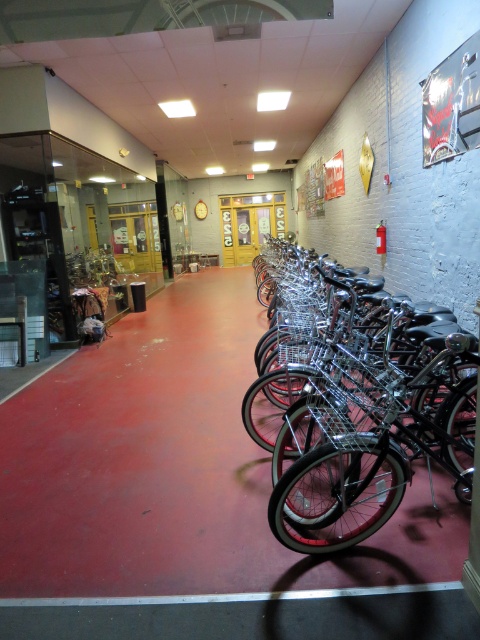
You are a customer entering the bicycle shop and see the shiny black bicycle at right and the white glossy line at lower center. Which object is closer to you?

The shiny black bicycle at right is closer to you because the white glossy line at lower center is behind it.

You are a customer entering the bicycle shop and see the shiny black bicycle at right and the white glossy line at lower center. Which object is positioned to the right side of the other?

The shiny black bicycle at right is to the right of the white glossy line at lower center.

You are a customer in the bicycle shop and want to place your newly purchased shiny black bicycle at right on the floor. The shop has a rule that all bicycles must be placed below the white glossy line at lower center. Can you place it there without moving the bicycle?

The shiny black bicycle at right is currently above the white glossy line at lower center, so it does not comply with the shop rule. To place it below the line, you would need to move the bicycle downward.